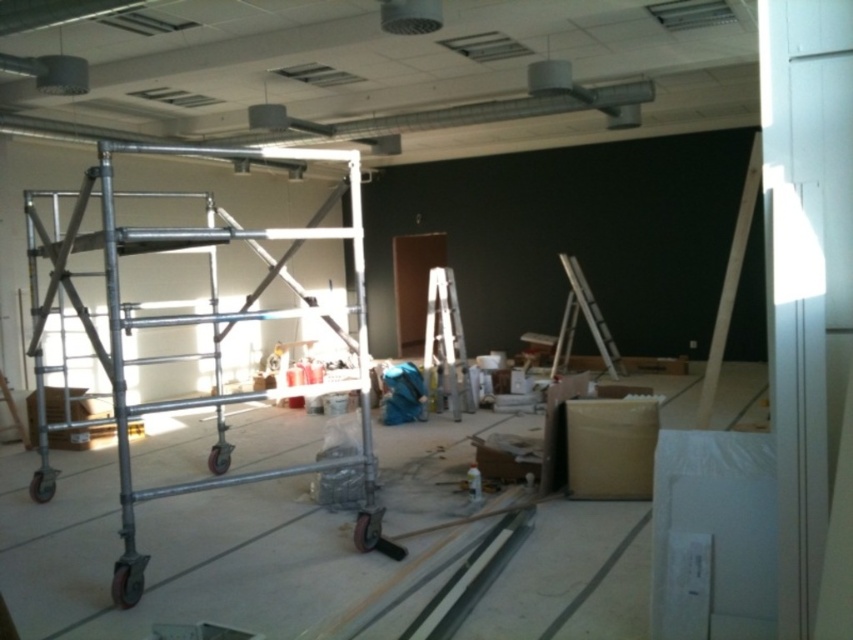
Question: In this image, where is silver metallic scaffolding at left located relative to metallic silver ladder at center right?

Choices:
 (A) left
 (B) right

Answer: (A)

Question: Which point is farther to the camera?

Choices:
 (A) (448, 300)
 (B) (111, 342)
 (C) (611, 369)

Answer: (C)

Question: Can you confirm if silver metallic scaffolding at left is bigger than silver metallic ladder at center?

Choices:
 (A) no
 (B) yes

Answer: (A)

Question: Estimate the real-world distances between objects in this image. Which object is closer to the silver metallic scaffolding at left?

Choices:
 (A) silver metallic ladder at center
 (B) metallic silver ladder at center right

Answer: (A)

Question: Which object is closer to the camera taking this photo?

Choices:
 (A) metallic silver ladder at center right
 (B) silver metallic scaffolding at left

Answer: (B)

Question: Is silver metallic scaffolding at left above metallic silver ladder at center right?

Choices:
 (A) yes
 (B) no

Answer: (A)